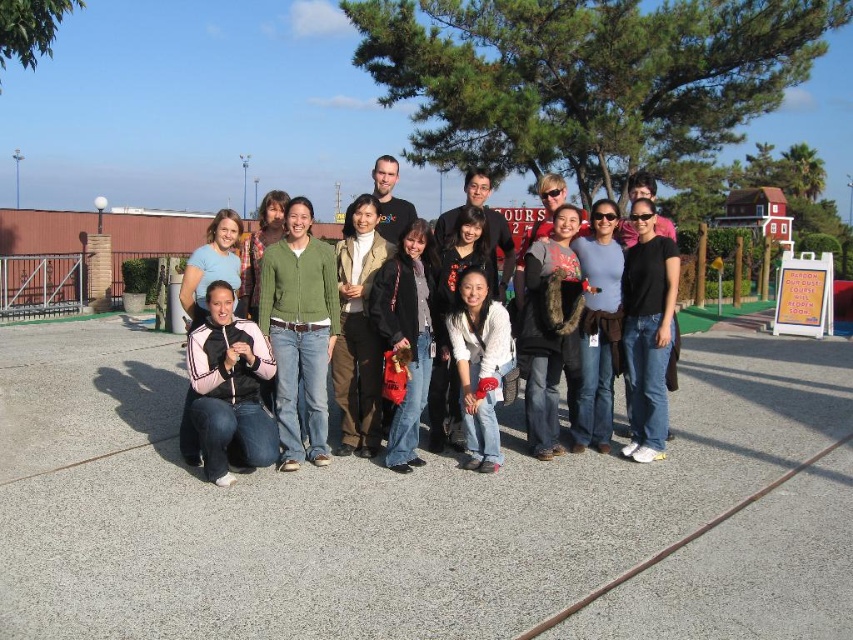
Question: Which point is farther to the camera?

Choices:
 (A) (216, 301)
 (B) (486, 180)
 (C) (448, 410)

Answer: (B)

Question: Observing the image, what is the correct spatial positioning of white matte jacket at center in reference to floral fabric shirt at center?

Choices:
 (A) above
 (B) below

Answer: (B)

Question: Which object is the farthest from the pink and white jacket at lower left?

Choices:
 (A) white matte jacket at center
 (B) floral fabric shirt at center

Answer: (B)

Question: Is matte black jacket at center to the right of floral fabric shirt at center from the viewer's perspective?

Choices:
 (A) no
 (B) yes

Answer: (A)

Question: Observing the image, what is the correct spatial positioning of matte black jacket at center in reference to white matte jacket at center?

Choices:
 (A) right
 (B) left

Answer: (A)

Question: Which of these objects is positioned closest to the white matte jacket at center?

Choices:
 (A) pink and white jacket at lower left
 (B) matte black jacket at center

Answer: (B)